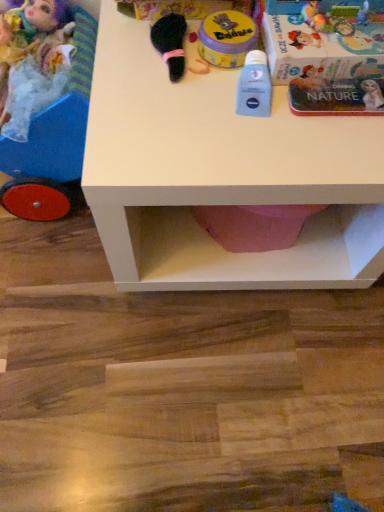
Question: Is matte plastic doll carriage at left, which is the 2th toy in left-to-right order, inside the boundaries of white matte table at center, or outside?

Choices:
 (A) outside
 (B) inside

Answer: (A)

Question: From a real-world perspective, is matte plastic doll carriage at left, placed as the 3th toy when sorted from right to left, physically located above or below white matte table at center?

Choices:
 (A) below
 (B) above

Answer: (B)

Question: Based on their relative distances, which object is nearer to the yellow matte container at upper center, positioned as the third toy in left-to-right order?

Choices:
 (A) metallic silver book at upper right
 (B) blue matte lotion at center, the 1th toy viewed from the right
 (C) matte plastic doll carriage at left, which is the 2th toy in left-to-right order
 (D) white matte table at center
 (E) plush doll at left, which is the 1th toy in left-to-right order

Answer: (B)

Question: Which is nearer to the matte plastic doll carriage at left, placed as the 3th toy when sorted from right to left?

Choices:
 (A) metallic silver book at upper right
 (B) yellow matte container at upper center, positioned as the third toy in left-to-right order
 (C) white matte table at center
 (D) blue matte lotion at center, which appears as the fourth toy when viewed from the left
 (E) plush doll at left, arranged as the fourth toy when viewed from the right

Answer: (E)